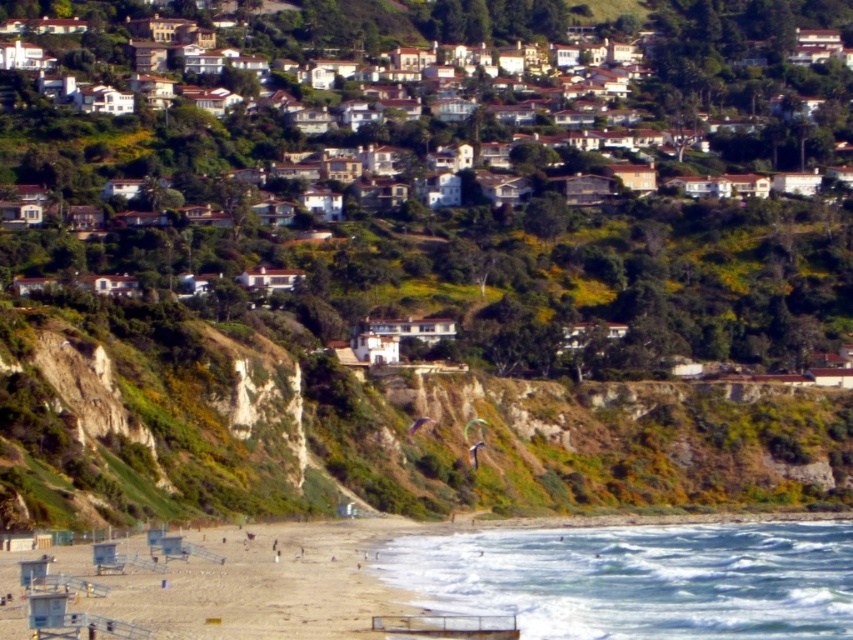
Can you confirm if blue-green water at lower center is shorter than beige sandy beach at lower left?

No.

Does point (572, 611) come in front of point (259, 554)?

Yes, it is in front of point (259, 554).

Which is behind, point (517, 611) or point (320, 538)?

Point (320, 538)

Identify the location of blue-green water at lower center. Image resolution: width=853 pixels, height=640 pixels. (639, 579).

Which is below, white stucco houses at center or blue-green water at lower center?

blue-green water at lower center is below.

Who is more distant from viewer, [839,115] or [836,630]?

The point [839,115] is behind.

Where is `white stucco houses at center`? The height and width of the screenshot is (640, 853). white stucco houses at center is located at coordinates (416, 136).

Does white stucco houses at center appear under beige sandy beach at lower left?

Incorrect, white stucco houses at center is not positioned below beige sandy beach at lower left.

How much distance is there between white stucco houses at center and beige sandy beach at lower left?

174.70 meters

Does point (740, 141) come behind point (131, 593)?

Yes, it is.

This screenshot has width=853, height=640. What are the coordinates of `white stucco houses at center` in the screenshot? It's located at (416, 136).